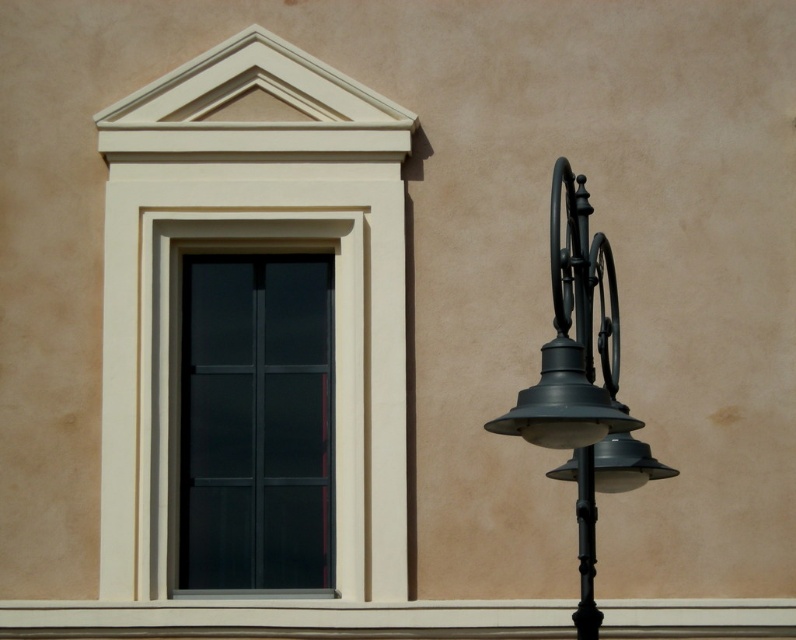
Can you confirm if matte black window at center is wider than matte black street light at right?

Correct, the width of matte black window at center exceeds that of matte black street light at right.

Can you confirm if matte black window at center is positioned below matte black street light at right?

Yes.

Between point (305, 396) and point (568, 422), which one is positioned in front?

Point (568, 422) is in front.

Image resolution: width=796 pixels, height=640 pixels. Find the location of `matte black window at center`. matte black window at center is located at coordinates (256, 420).